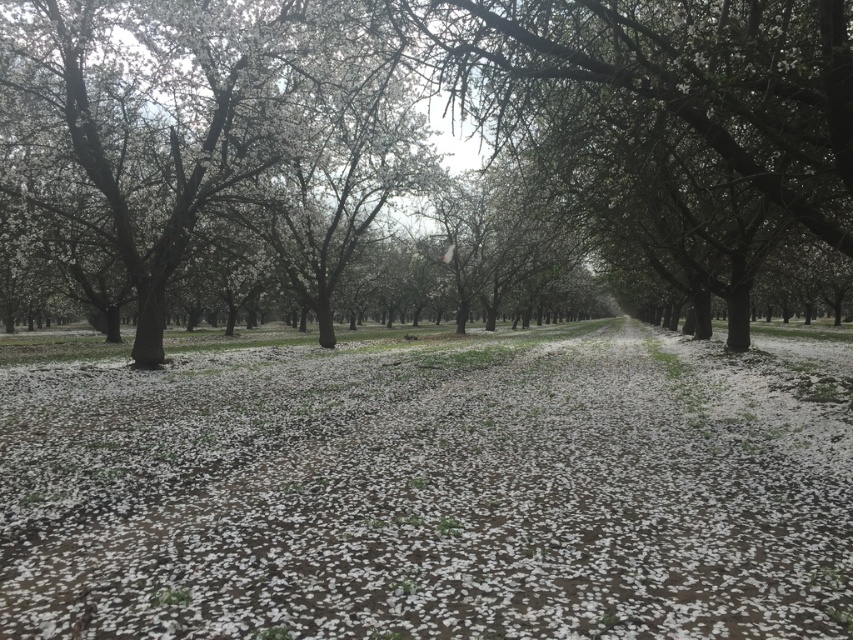
Question: Can you confirm if white matte petals at center is thinner than white blossoms at center?

Choices:
 (A) no
 (B) yes

Answer: (B)

Question: Does white matte petals at center appear on the left side of white blossoms at center?

Choices:
 (A) no
 (B) yes

Answer: (A)

Question: Does white matte petals at center have a larger size compared to white blossoms at center?

Choices:
 (A) yes
 (B) no

Answer: (B)

Question: Which object is closer to the camera taking this photo?

Choices:
 (A) white blossoms at center
 (B) white matte petals at center

Answer: (B)